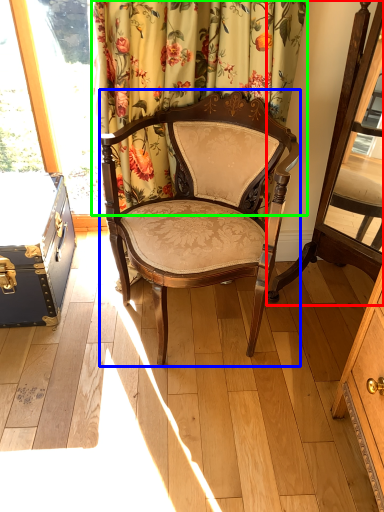
Question: Which object is the farthest from swivel chair (highlighted by a red box)? Choose among these: chair (highlighted by a blue box) or curtain (highlighted by a green box).

Choices:
 (A) chair
 (B) curtain

Answer: (B)